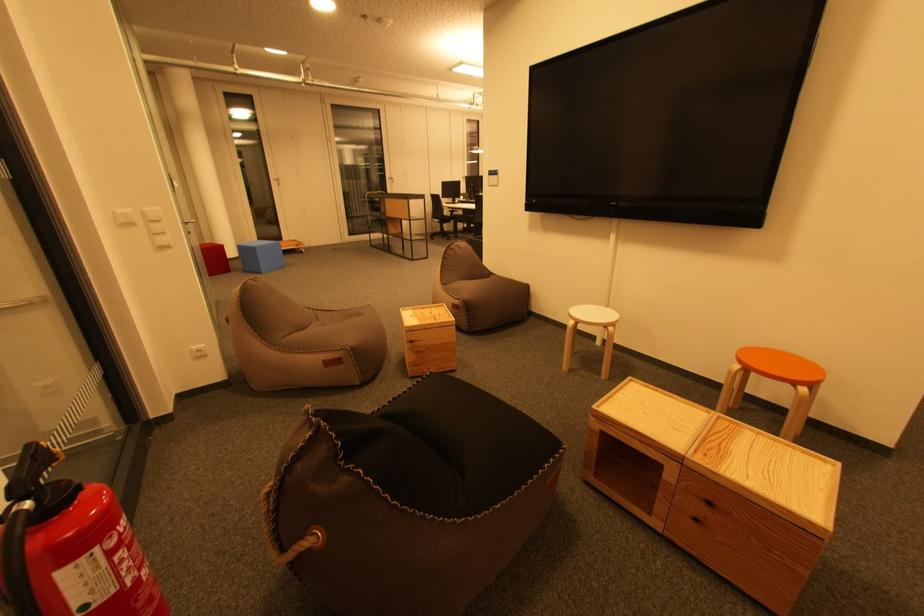
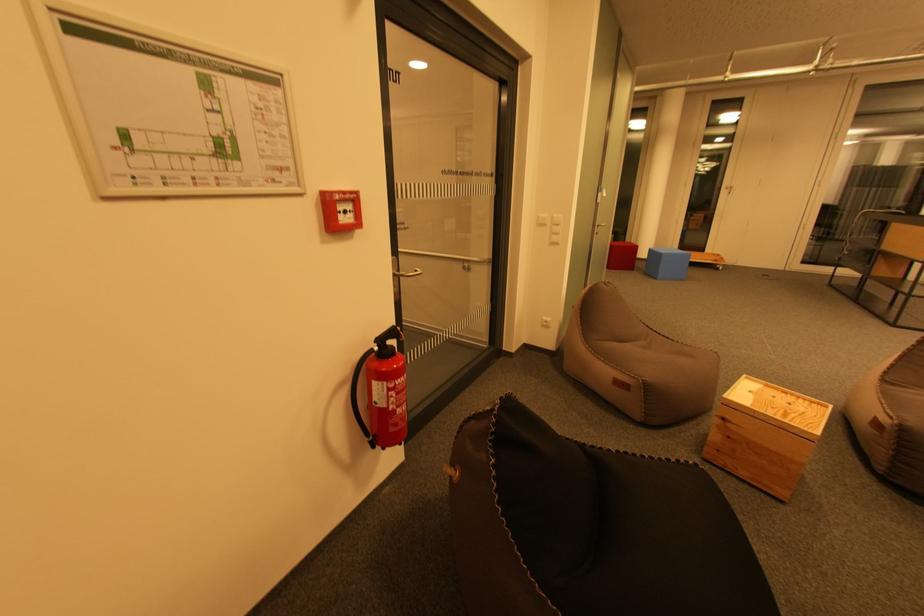
Question: How did the camera likely rotate?

Choices:
 (A) Left
 (B) Right
 (C) Up
 (D) Down

Answer: (A)